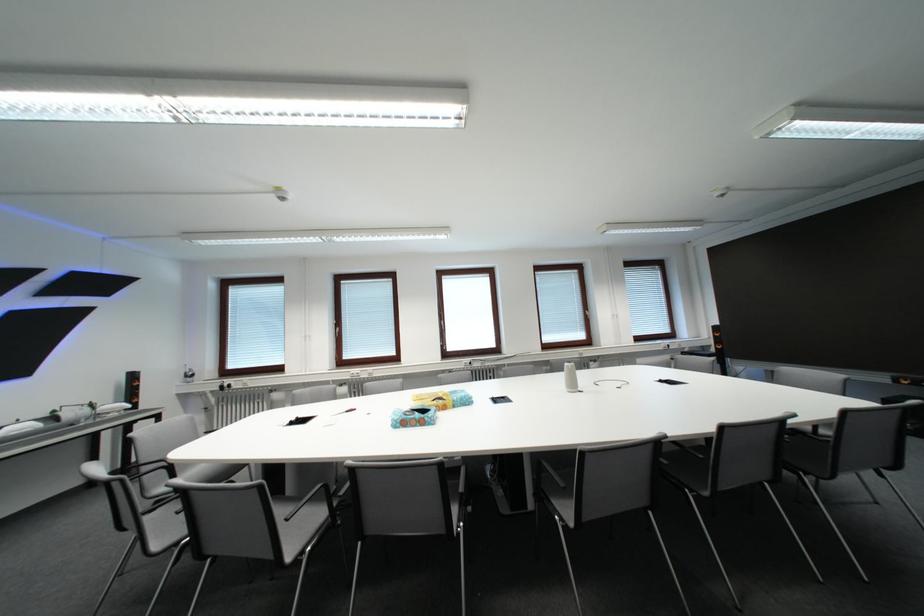
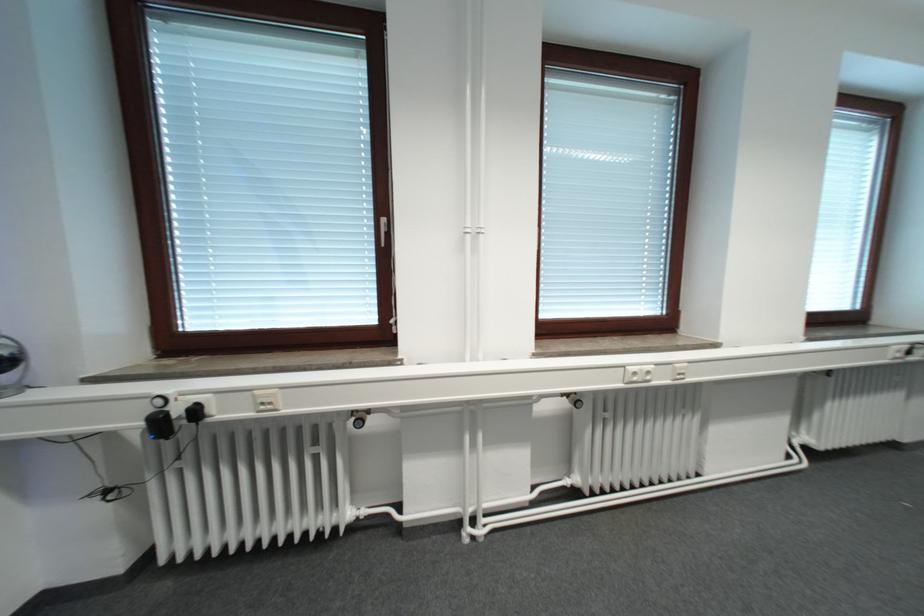
Which direction would the cameraman need to move to produce the second image?

The cameraman walked toward left, forward.